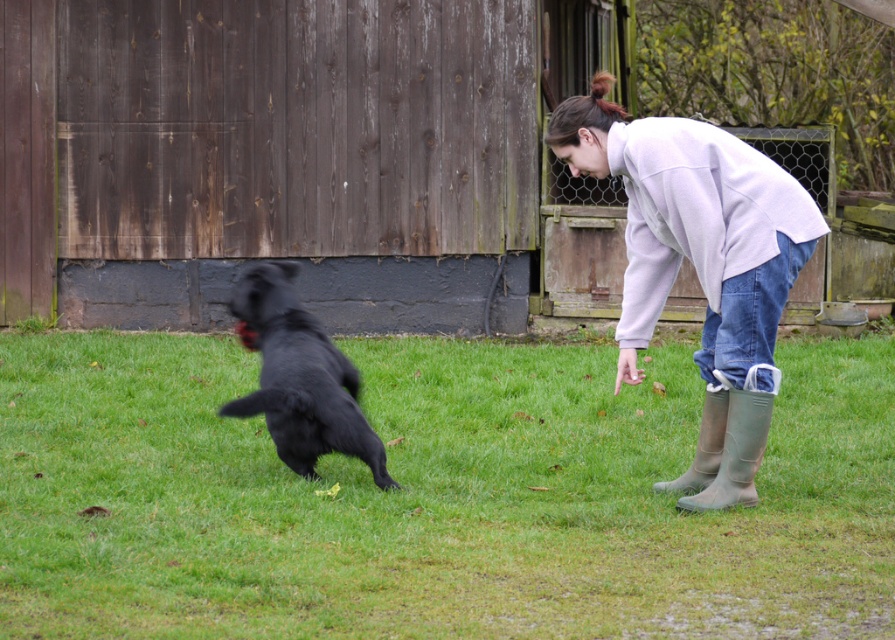
Question: Among these objects, which one is nearest to the camera?

Choices:
 (A) green rubber boots at lower right
 (B) shiny black dog at center
 (C) light purple fleece at center

Answer: (C)

Question: Is light purple fleece at center above green rubber boots at lower right?

Choices:
 (A) yes
 (B) no

Answer: (A)

Question: Does green grass at lower center appear under rubber boots at lower right?

Choices:
 (A) yes
 (B) no

Answer: (A)

Question: Can you confirm if light purple fleece at center is wider than rubber boots at lower right?

Choices:
 (A) yes
 (B) no

Answer: (A)

Question: Which point is farther to the camera?

Choices:
 (A) (722, 390)
 (B) (448, 356)
 (C) (359, 412)

Answer: (B)

Question: Which point is closer to the camera taking this photo?

Choices:
 (A) (706, 500)
 (B) (344, 387)
 (C) (680, 502)
 (D) (713, 417)

Answer: (A)